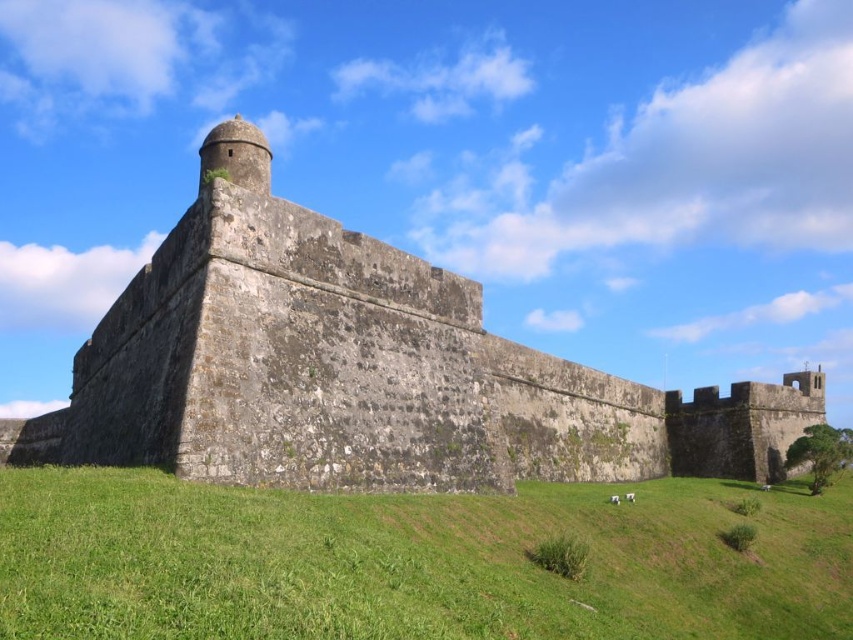
Question: Does stone wall at center have a greater width compared to green grass at lower center?

Choices:
 (A) yes
 (B) no

Answer: (A)

Question: Can you confirm if stone wall at center is positioned to the left of green grass at lower center?

Choices:
 (A) no
 (B) yes

Answer: (B)

Question: Which point appears farthest from the camera in this image?

Choices:
 (A) (119, 570)
 (B) (437, 344)

Answer: (B)

Question: Is stone wall at center smaller than green grass at lower center?

Choices:
 (A) no
 (B) yes

Answer: (A)

Question: Among these points, which one is farthest from the camera?

Choices:
 (A) pyautogui.click(x=77, y=593)
 (B) pyautogui.click(x=170, y=285)

Answer: (B)

Question: Which of the following is the farthest from the observer?

Choices:
 (A) (670, 564)
 (B) (653, 452)

Answer: (B)